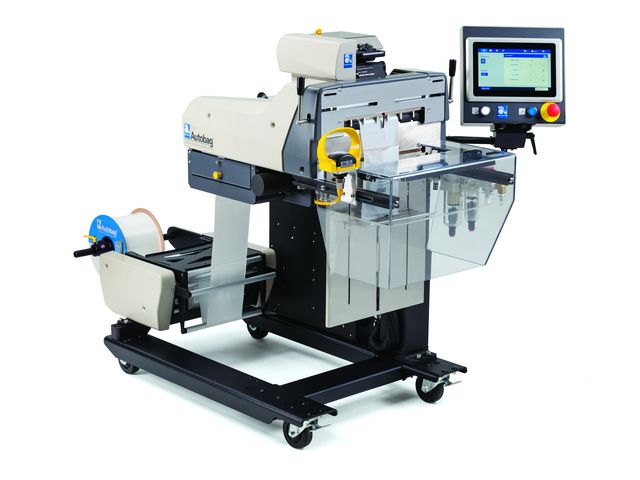
I want to click on copier, so click(x=379, y=181).